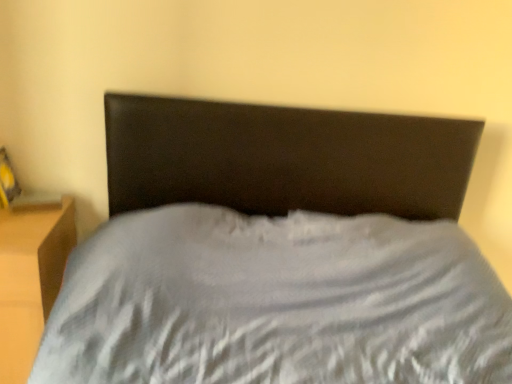
The image size is (512, 384). What are the coordinates of `wooden nightstand at left` in the screenshot? It's located at (30, 278).

What do you see at coordinates (30, 278) in the screenshot? Image resolution: width=512 pixels, height=384 pixels. I see `wooden nightstand at left` at bounding box center [30, 278].

Measure the distance between wooden nightstand at left and camera.

wooden nightstand at left is 4.29 feet away from camera.

Locate an element on the screen. The height and width of the screenshot is (384, 512). wooden nightstand at left is located at coordinates (30, 278).